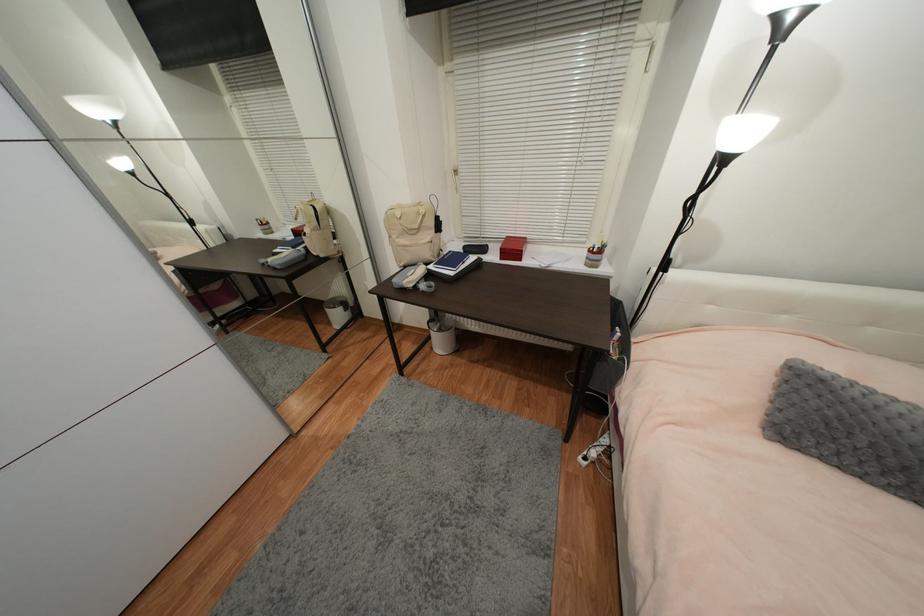
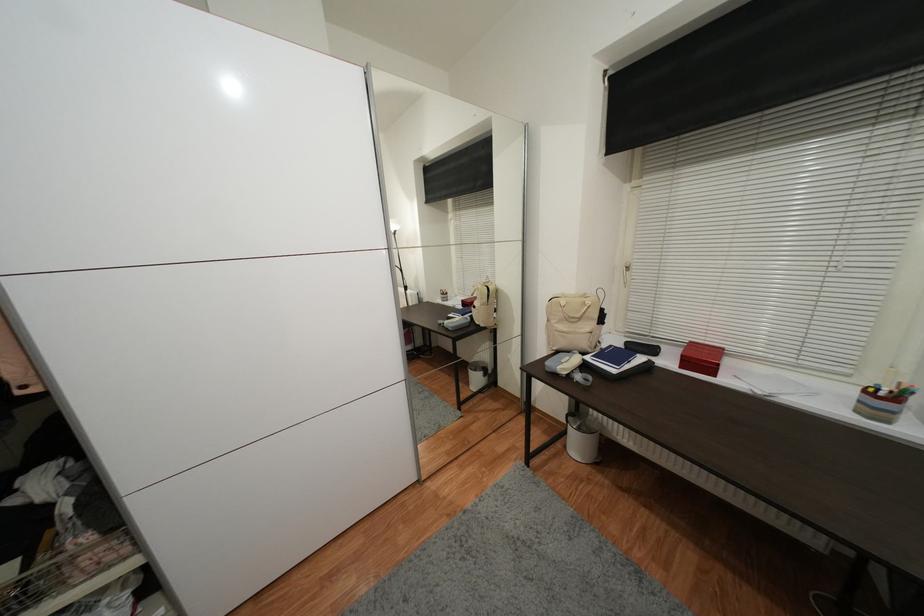
In the second image, find the point that corresponds to (435,268) in the first image.

(592, 360)